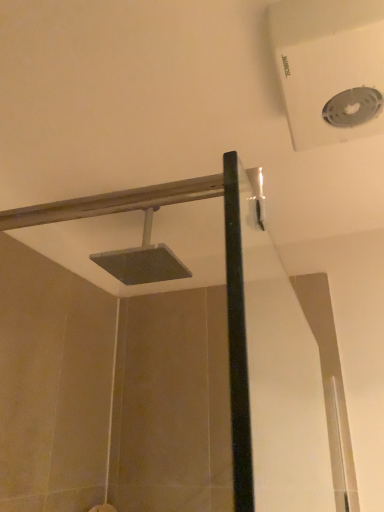
What do you see at coordinates (143, 260) in the screenshot?
I see `matte black showerhead at center` at bounding box center [143, 260].

Identify the location of matte black showerhead at center. The height and width of the screenshot is (512, 384). (143, 260).

What is the approximate width of matte black showerhead at center?

It is 8.05 inches.

Where is `matte black showerhead at center`? matte black showerhead at center is located at coordinates (143, 260).